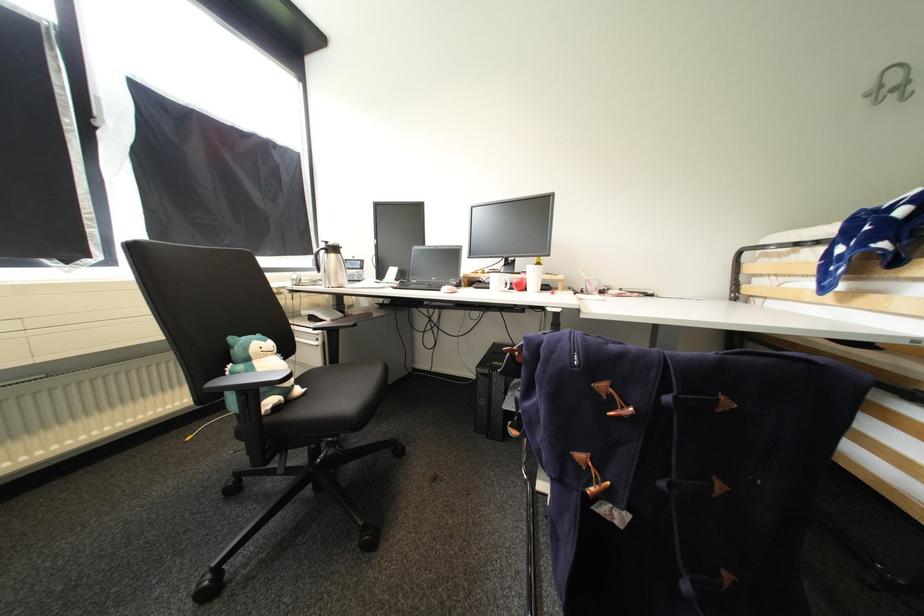
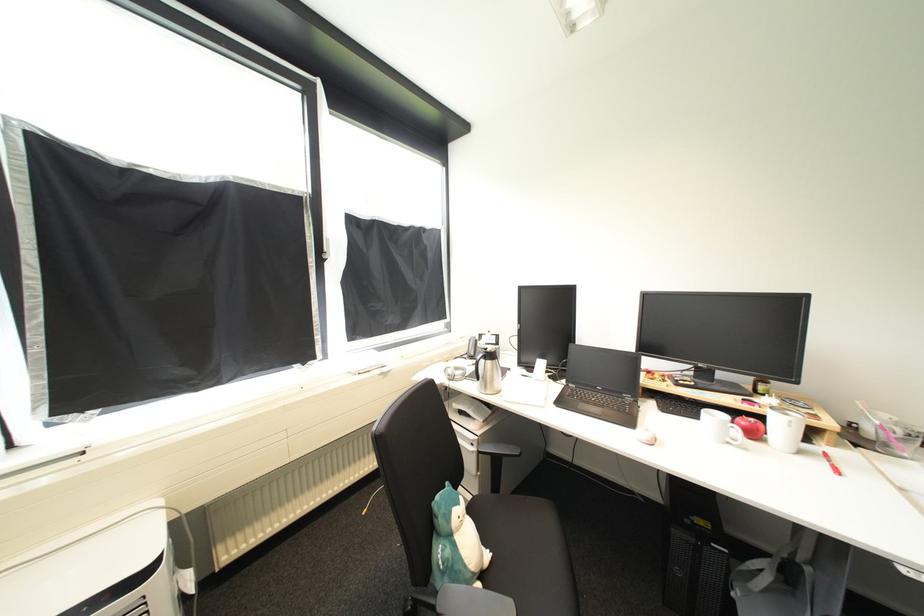
The point at [103,126] is marked in the first image. Where is the corresponding point in the second image?

(331, 257)